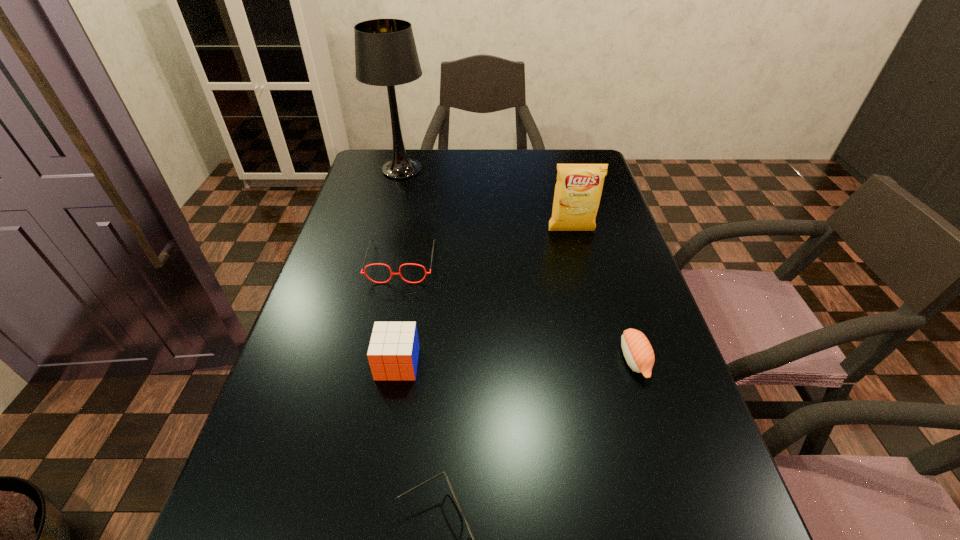
Identify which object is located as the fifth nearest to the nearest object. Please provide its 2D coordinates. Your answer should be formatted as a tuple, i.e. [(x, y)], where the tuple contains the x and y coordinates of a point satisfying the conditions above.

[(385, 51)]

This screenshot has width=960, height=540. What are the coordinates of `the fourth closest object to the farther spectacles` in the screenshot? It's located at (637, 350).

You are a GUI agent. You are given a task and a screenshot of the screen. Output one action in this format:
    pyautogui.click(x=<x>, y=<y>)
    Task: Click on the blank space that satisfies the following two spatial constraints: 1. on the front side of the table lamp; 2. on the left side of the cube
    This screenshot has height=540, width=960.
    Given the screenshot: What is the action you would take?
    point(351,363)

Identify the location of vacant space that satisfies the following two spatial constraints: 1. on the front-facing side of the farther spectacles; 2. on the left side of the cube. The height and width of the screenshot is (540, 960). (381, 363).

The image size is (960, 540). I want to click on vacant space that satisfies the following two spatial constraints: 1. on the front-facing side of the sushi; 2. on the left side of the farther spectacles, so tap(382, 360).

Locate an element on the screen. vacant region that satisfies the following two spatial constraints: 1. on the front side of the cube; 2. on the right side of the table lamp is located at coordinates (351, 363).